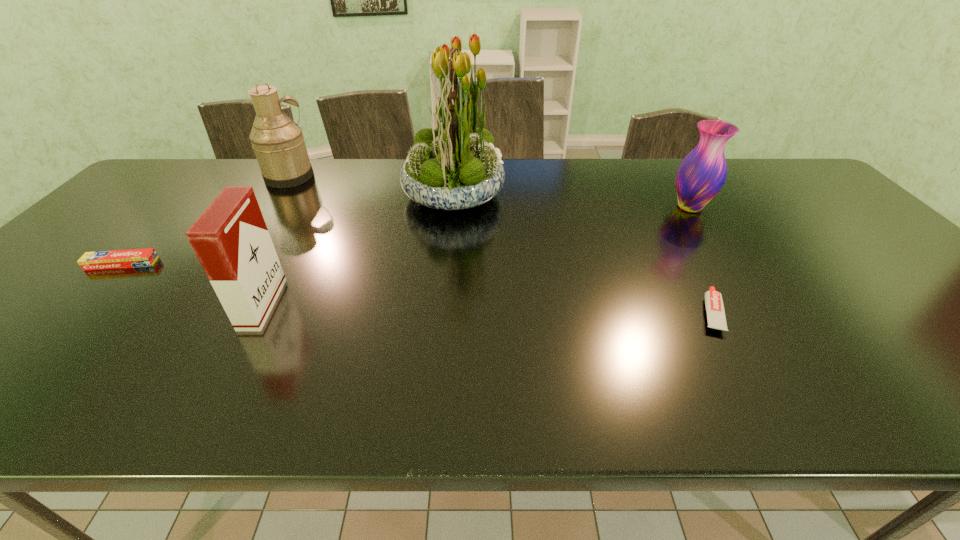
This screenshot has height=540, width=960. I want to click on free space located 0.050m on the front-facing side of the flower arrangement, so [520, 193].

Locate an element on the screen. The image size is (960, 540). vacant space located 0.270m on the front of the fifth shortest object is located at coordinates (250, 239).

Identify the location of vacant region located on the front-facing side of the third object from left to right. (344, 304).

Image resolution: width=960 pixels, height=540 pixels. I want to click on free spot located on the back of the rightmost object, so click(672, 180).

Where is `free point located on the left of the third nearest object`? The image size is (960, 540). free point located on the left of the third nearest object is located at coordinates (70, 264).

Where is `free space located 0.370m on the left of the nearer toothpaste`? This screenshot has width=960, height=540. free space located 0.370m on the left of the nearer toothpaste is located at coordinates (533, 313).

What are the coordinates of `flower arrangement present at the far edge` in the screenshot? It's located at (453, 167).

Identify the location of pitcher positioned at the far edge. This screenshot has width=960, height=540. (278, 142).

Where is `object at the left edge`? object at the left edge is located at coordinates (100, 260).

Identify the location of free space at the far edge of the desktop. The image size is (960, 540). click(x=344, y=186).